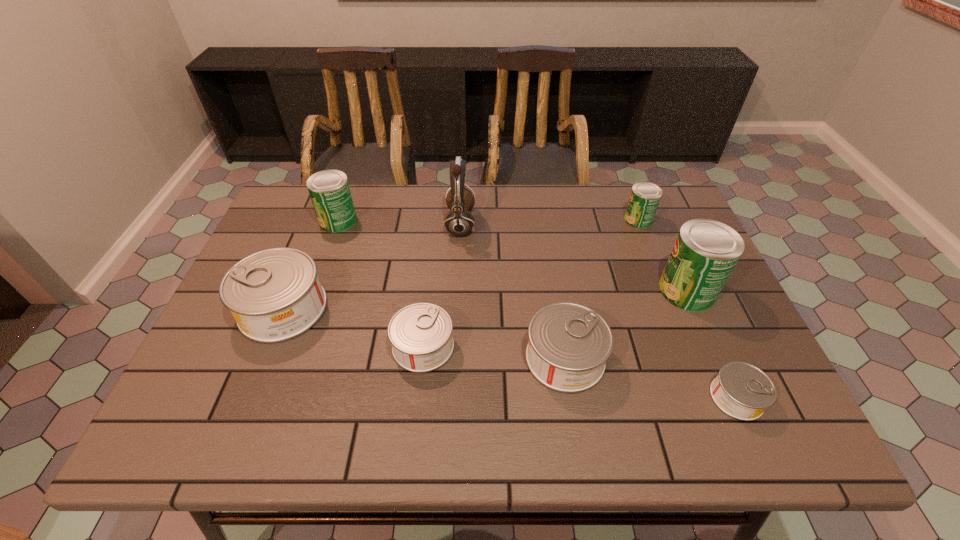
Where is `free space at the near left corner of the desktop`? This screenshot has height=540, width=960. free space at the near left corner of the desktop is located at coordinates (190, 414).

Image resolution: width=960 pixels, height=540 pixels. I want to click on vacant space at the near right corner of the desktop, so click(745, 429).

Locate an element on the screen. Image resolution: width=960 pixels, height=540 pixels. unoccupied position between the tallest object and the fourth can from left to right is located at coordinates (513, 291).

Locate an element on the screen. This screenshot has width=960, height=540. free space between the second tallest can and the tallest object is located at coordinates (399, 222).

This screenshot has height=540, width=960. In order to click on empty location between the second smallest silver can and the tallest object in this screenshot , I will do `click(442, 285)`.

Locate an element on the screen. free space that is in between the second smallest green can and the tallest can is located at coordinates (513, 255).

Locate an element on the screen. Image resolution: width=960 pixels, height=540 pixels. vacant space in between the shortest object and the brown earphone is located at coordinates (598, 310).

Identify the location of free space between the shortest object and the nearest green can. (711, 344).

This screenshot has height=540, width=960. I want to click on vacant area that lies between the shortest can and the sixth shortest object, so click(538, 309).

Identify the location of the closest object to the second silver can from left to right. Image resolution: width=960 pixels, height=540 pixels. (569, 343).